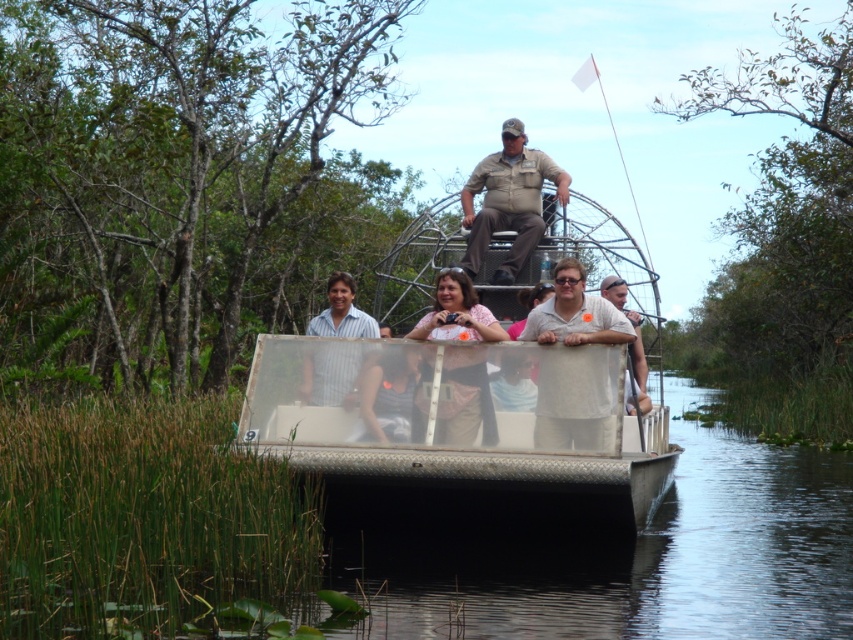
Question: Estimate the real-world distances between objects in this image. Which object is farther from the khaki uniform at center?

Choices:
 (A) striped cotton shirt at center
 (B) metallic silver airboat at center
 (C) gray matte shirt at center

Answer: (C)

Question: Is metallic silver airboat at center wider than striped cotton shirt at center?

Choices:
 (A) no
 (B) yes

Answer: (B)

Question: Which object appears closest to the camera in this image?

Choices:
 (A) khaki uniform at center
 (B) metallic silver airboat at center

Answer: (B)

Question: Can you confirm if metallic silver airboat at center is bigger than khaki uniform at center?

Choices:
 (A) yes
 (B) no

Answer: (A)

Question: Which point is closer to the camera taking this photo?

Choices:
 (A) (344, 397)
 (B) (479, 227)

Answer: (A)

Question: Considering the relative positions of metallic silver airboat at center and striped cotton shirt at center in the image provided, where is metallic silver airboat at center located with respect to striped cotton shirt at center?

Choices:
 (A) right
 (B) left

Answer: (A)